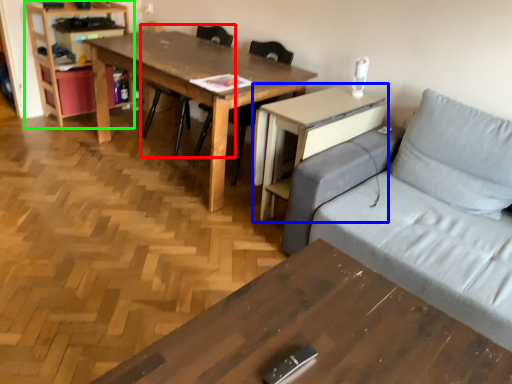
Question: Which object is the closest to the chair (highlighted by a red box)? Choose among these: computer desk (highlighted by a blue box) or bookshelf (highlighted by a green box).

Choices:
 (A) computer desk
 (B) bookshelf

Answer: (B)